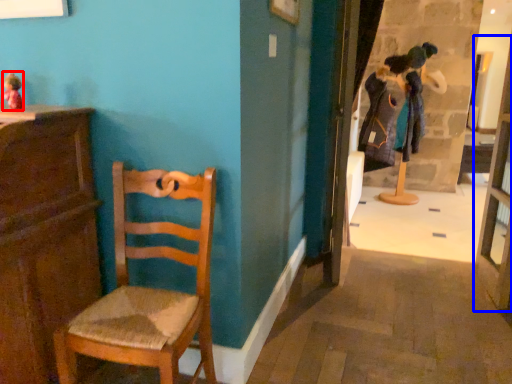
Question: Which of the following is the closest to the observer, toy (highlighted by a red box) or glass door (highlighted by a blue box)?

Choices:
 (A) toy
 (B) glass door

Answer: (A)